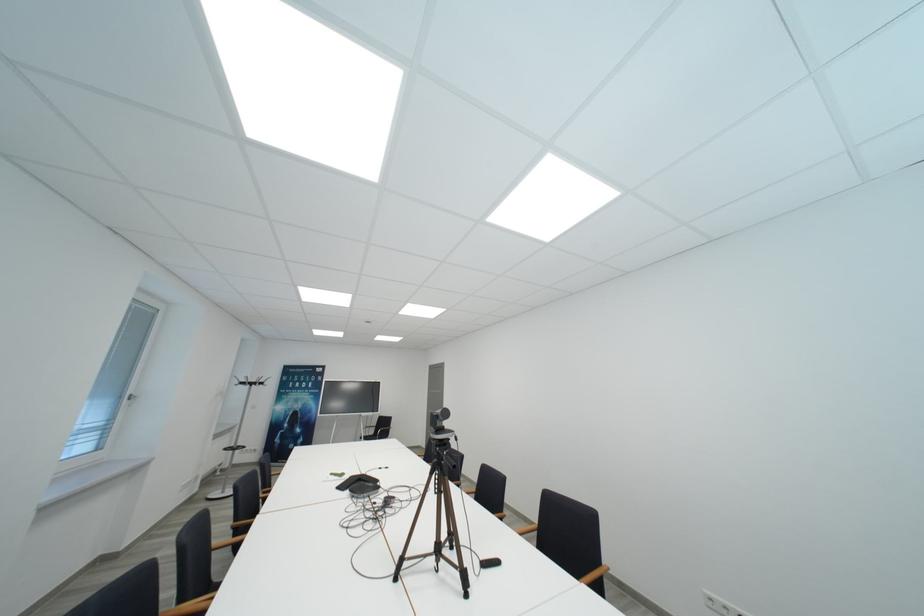
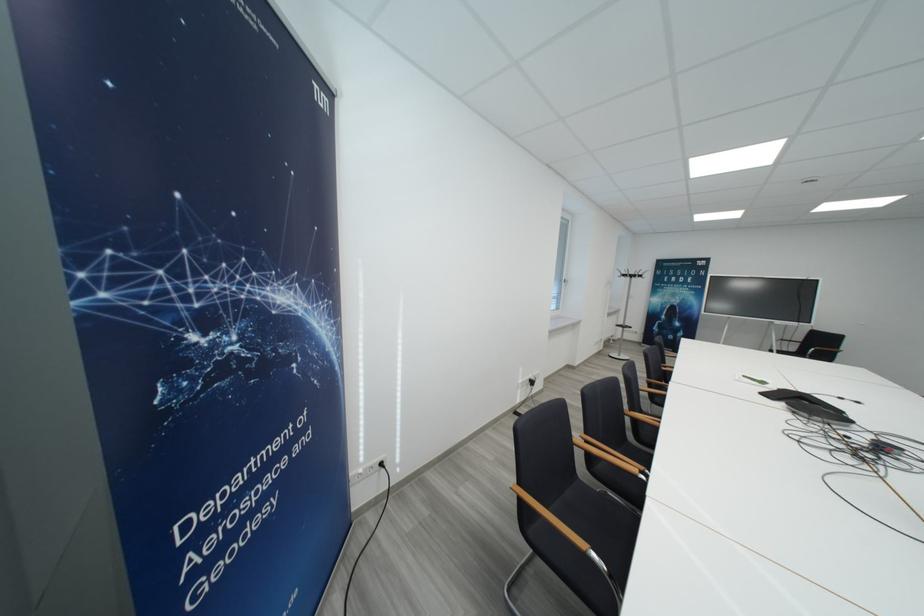
Locate, in the second image, the point that corresponds to the point at 250,386 in the first image.

(631, 278)